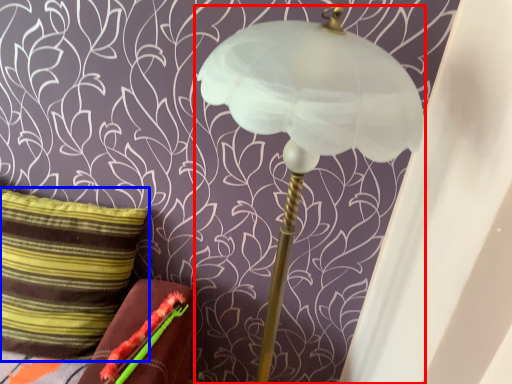
Question: Which point is closer to the camera, lamp (highlighted by a red box) or pillow (highlighted by a blue box)?

Choices:
 (A) lamp
 (B) pillow

Answer: (A)